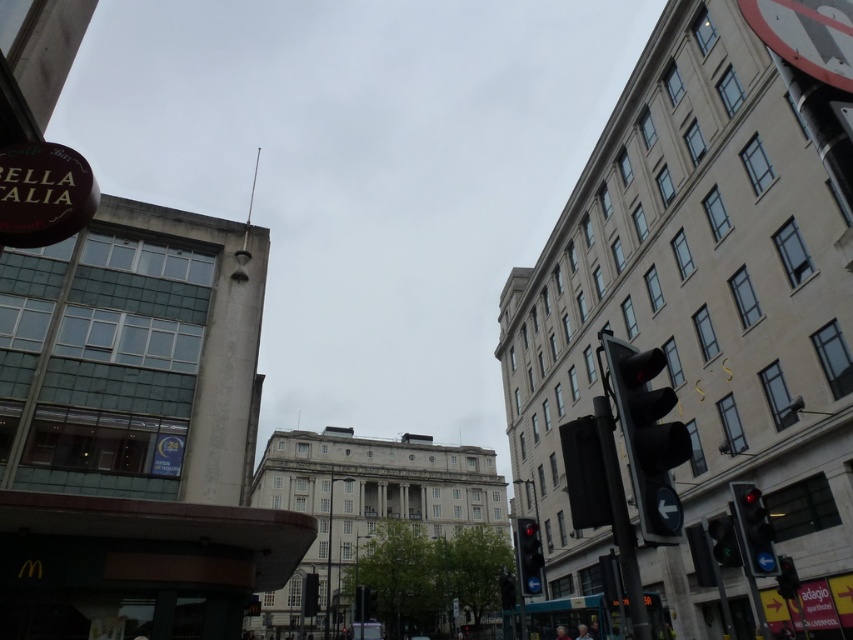
Is point (640, 634) less distant than point (770, 572)?

Yes.

Between point (611, 456) and point (759, 518), which one is positioned behind?

The point (759, 518) is more distant.

This screenshot has height=640, width=853. What are the coordinates of `metallic pole at right` in the screenshot? It's located at (619, 518).

Does red glass traffic light at right appear under red glass traffic light at center?

Incorrect, red glass traffic light at right is not positioned below red glass traffic light at center.

Is red glass traffic light at right to the right of red glass traffic light at center from the viewer's perspective?

Indeed, red glass traffic light at right is positioned on the right side of red glass traffic light at center.

What do you see at coordinates (753, 529) in the screenshot? I see `red glass traffic light at right` at bounding box center [753, 529].

Image resolution: width=853 pixels, height=640 pixels. Find the location of `red glass traffic light at right`. red glass traffic light at right is located at coordinates (753, 529).

Can you confirm if black plastic traffic light at right is positioned below red glass traffic light at center?

Actually, black plastic traffic light at right is above red glass traffic light at center.

Which is more to the left, black plastic traffic light at right or red glass traffic light at center?

Positioned to the left is black plastic traffic light at right.

Does point (659, 540) come closer to viewer compared to point (521, 532)?

Yes, point (659, 540) is closer to viewer.

What are the coordinates of `black plastic traffic light at right` in the screenshot? It's located at (648, 436).